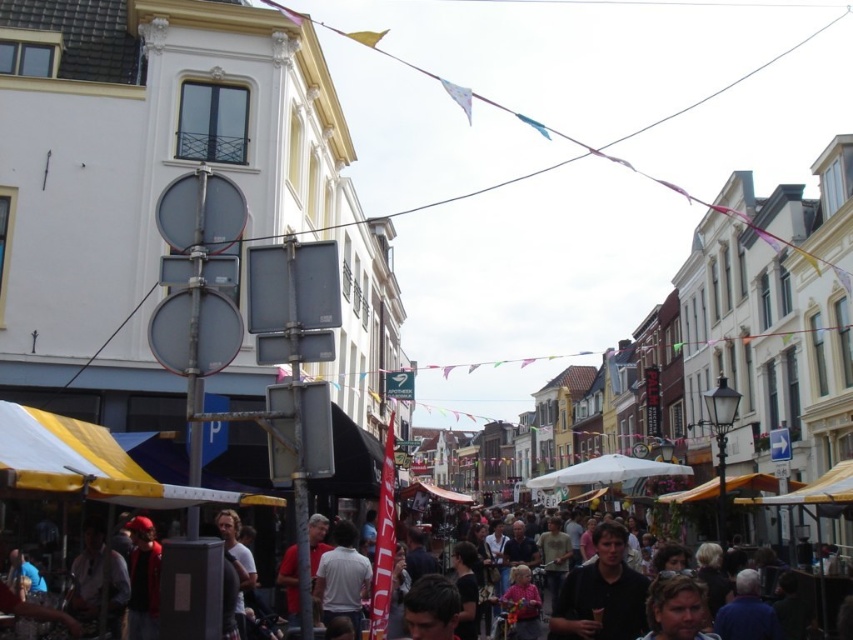
Can you confirm if dark brown shirt at center is positioned to the right of dark clothing crowd at center?

Correct, you'll find dark brown shirt at center to the right of dark clothing crowd at center.

Does dark brown shirt at center have a greater width compared to dark clothing crowd at center?

In fact, dark brown shirt at center might be narrower than dark clothing crowd at center.

Does point (601, 566) come closer to viewer compared to point (822, 620)?

Yes, point (601, 566) is in front of point (822, 620).

At what (x,y) coordinates should I click in order to perform the action: click on dark brown shirt at center. Please return your answer as a coordinate pair (x, y). This screenshot has height=640, width=853. Looking at the image, I should click on (601, 593).